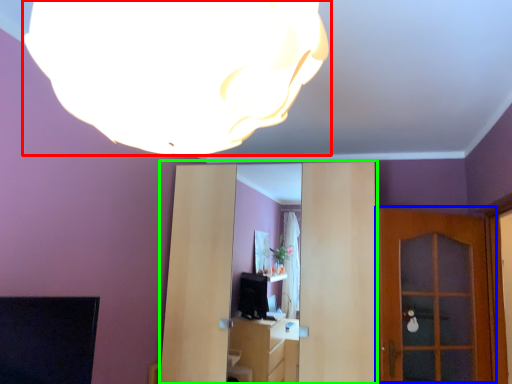
Question: Which object is the closest to the lamp (highlighted by a red box)? Choose among these: door (highlighted by a blue box) or entertainment center (highlighted by a green box).

Choices:
 (A) door
 (B) entertainment center

Answer: (B)